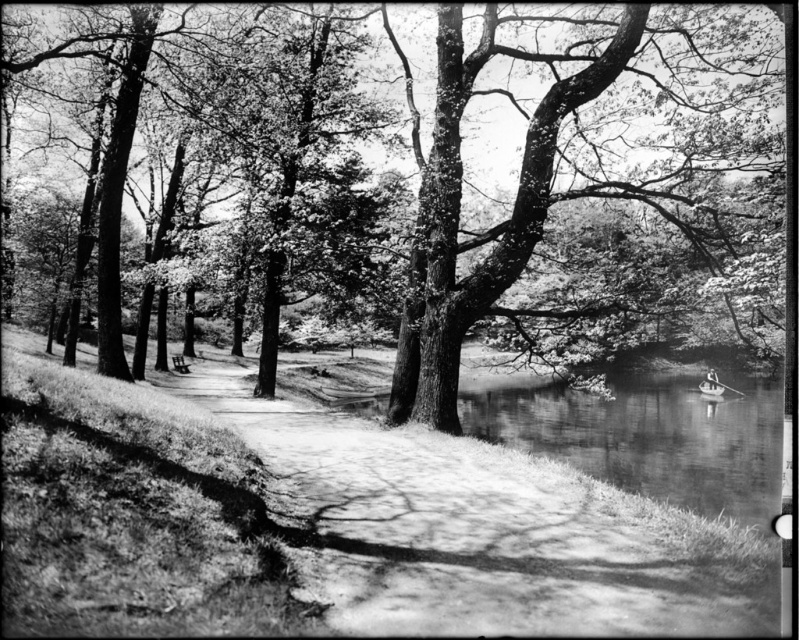
Does smooth dirt path at center appear under wooden park bench at center?

Yes, smooth dirt path at center is below wooden park bench at center.

Is smooth dirt path at center smaller than wooden park bench at center?

Incorrect, smooth dirt path at center is not smaller in size than wooden park bench at center.

This screenshot has height=640, width=799. What do you see at coordinates (471, 531) in the screenshot? I see `smooth dirt path at center` at bounding box center [471, 531].

The image size is (799, 640). What are the coordinates of `smooth dirt path at center` in the screenshot? It's located at (471, 531).

Between point (702, 500) and point (183, 371), which one is positioned in front?

Point (702, 500) is in front.

The height and width of the screenshot is (640, 799). In order to click on smooth water at lower right in this screenshot , I will do `click(650, 436)`.

The image size is (799, 640). Describe the element at coordinates (570, 154) in the screenshot. I see `smooth bark tree at center` at that location.

Does smooth bark tree at center have a greater width compared to smooth water at lower right?

In fact, smooth bark tree at center might be narrower than smooth water at lower right.

Which is in front, point (627, 113) or point (464, 408)?

Point (627, 113) is more forward.

The width and height of the screenshot is (799, 640). What are the coordinates of `smooth bark tree at center` in the screenshot? It's located at (570, 154).